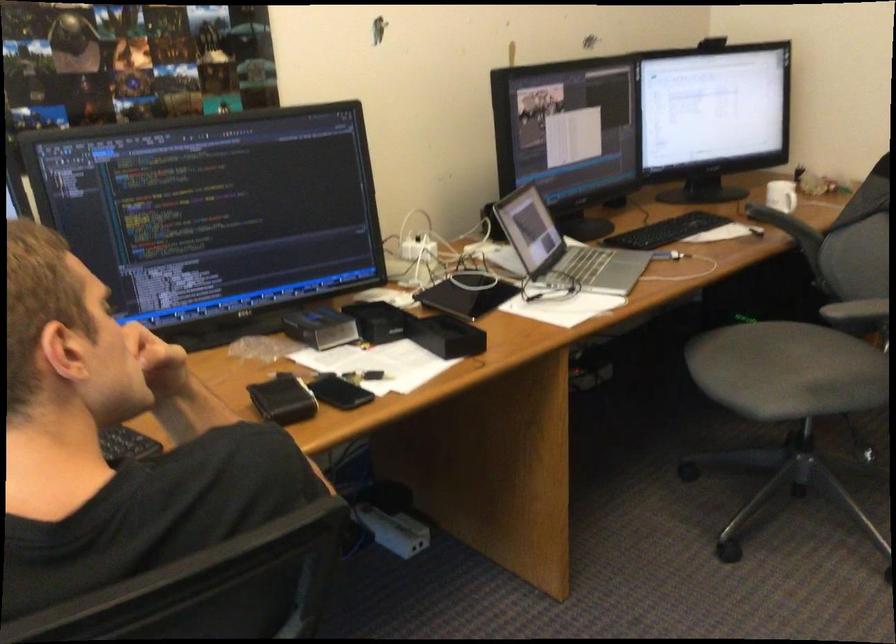
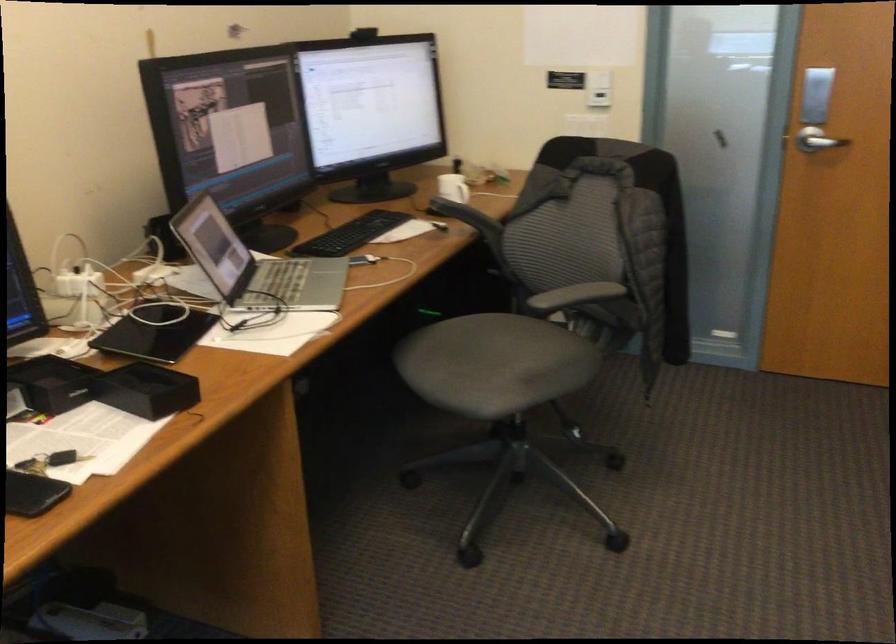
Which direction would the cameraman need to move to produce the second image?

The movement direction of the cameraman is left, forward.